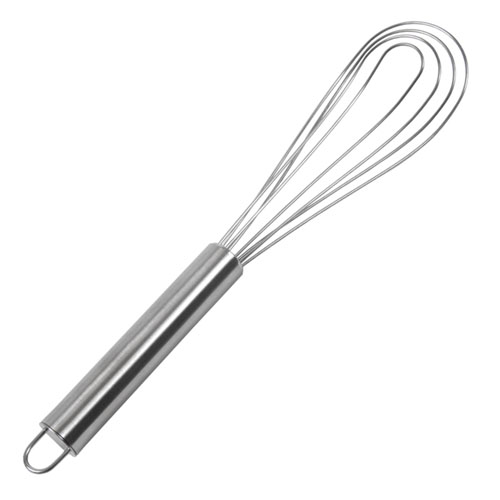
I want to click on steel handle, so click(x=152, y=332).